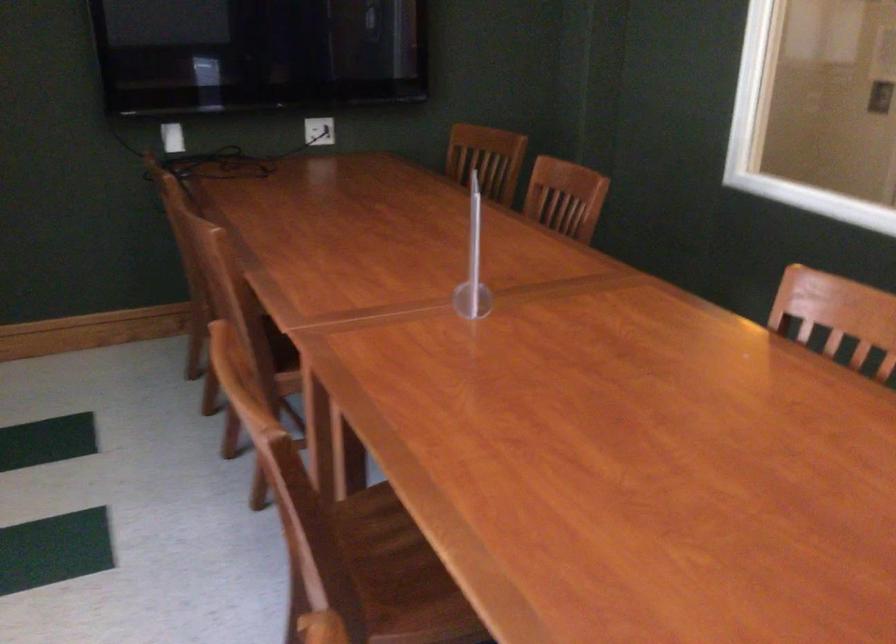
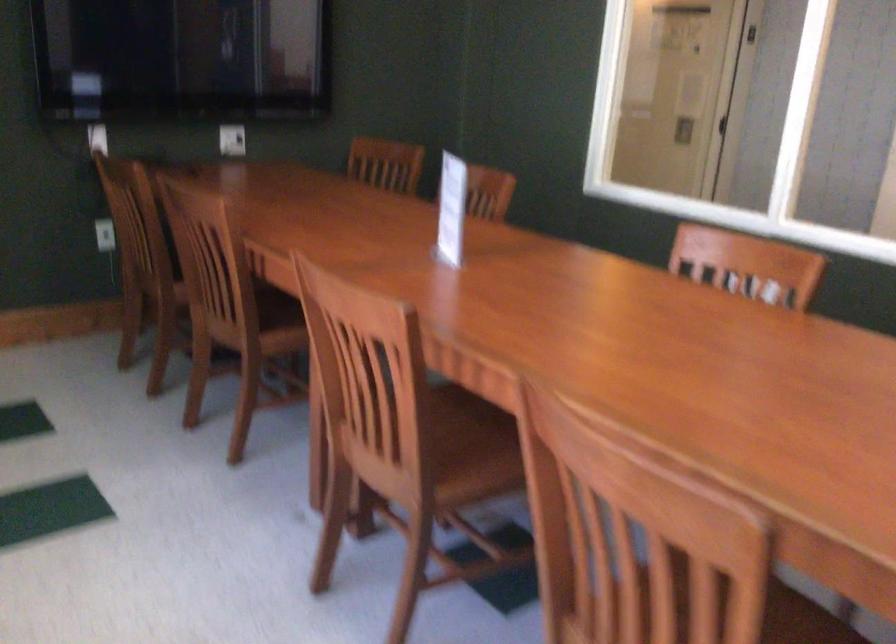
In a continuous first-person perspective shot, in which direction is the camera moving?

The cameraman moved toward left, backward.